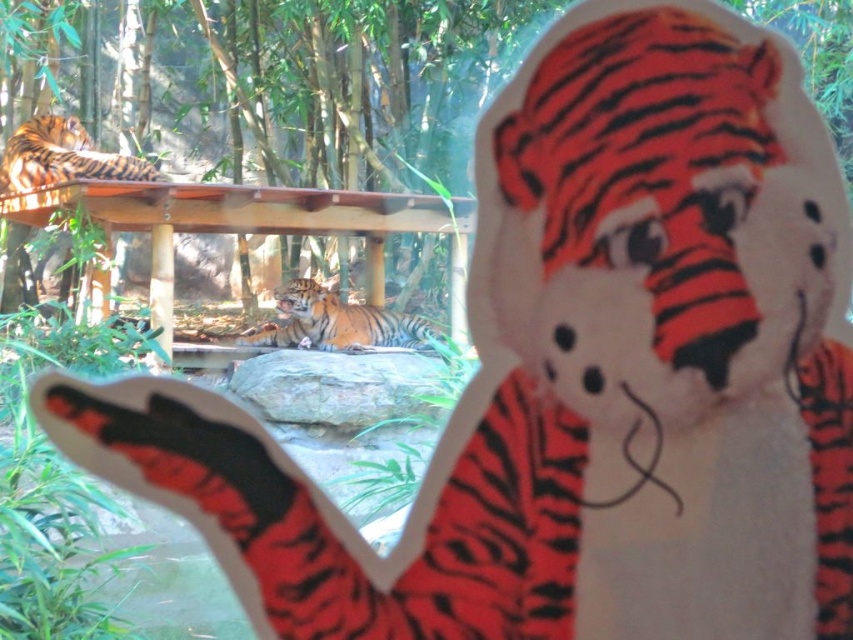
Looking at this image, you are a zookeeper observing the two orange striped tigers in the enclosure. Which tiger, the orange striped tiger at center or the orange striped tiger at upper left, is closer to you?

The orange striped tiger at center is closer to you because it is further to the viewer than the orange striped tiger at upper left.

You are a zookeeper planning to feed both orange striped tiger at center and orange striped tiger at upper left. If the feeding area can only accommodate one tiger at a time, which tiger should you feed first based on their size?

The orange striped tiger at center should be fed first because it is larger in width than the orange striped tiger at upper left, so you should prioritize feeding the larger tiger first.

From the picture: You are standing at the zoo and want to take a photo of the tiger hand puppet. The zoo requires visitors to maintain a minimum distance of 5 meters from any animal exhibit. If you are currently at the point labeled point (343, 321), can you safely take the photo without violating the safety distance rule?

The distance between point (343, 321) and the viewer is 5.89 meters, which is more than the required 5 meters. Therefore, you can safely take the photo without violating the safety distance rule.